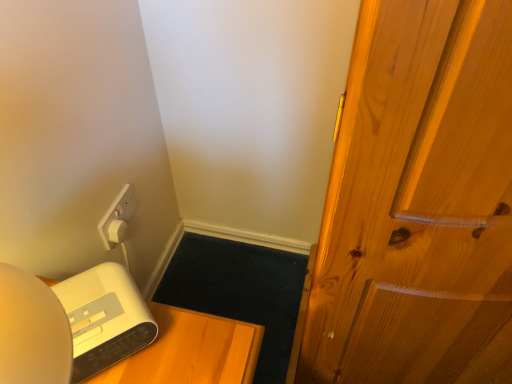
This screenshot has width=512, height=384. What do you see at coordinates (191, 351) in the screenshot?
I see `white matte speaker at lower left` at bounding box center [191, 351].

Identify the location of white matte speaker at lower left. (191, 351).

Where is `white plastic alarm clock at lower left`? The width and height of the screenshot is (512, 384). white plastic alarm clock at lower left is located at coordinates (104, 318).

What do you see at coordinates (104, 318) in the screenshot? I see `white plastic alarm clock at lower left` at bounding box center [104, 318].

Where is `white matte speaker at lower left`? This screenshot has height=384, width=512. white matte speaker at lower left is located at coordinates [191, 351].

In the image, is white matte speaker at lower left on the left side or the right side of white plastic alarm clock at lower left?

Based on their positions, white matte speaker at lower left is located to the right of white plastic alarm clock at lower left.

Is the depth of white matte speaker at lower left less than that of white plastic alarm clock at lower left?

No, the depth of white matte speaker at lower left is greater than that of white plastic alarm clock at lower left.

Is point (203, 326) behind point (105, 272)?

No, (203, 326) is in front of (105, 272).

From the image's perspective, is white matte speaker at lower left above white plastic alarm clock at lower left?

Actually, white matte speaker at lower left appears below white plastic alarm clock at lower left in the image.

From a real-world perspective, relative to white plastic alarm clock at lower left, is white matte speaker at lower left vertically above or below?

white matte speaker at lower left is situated lower than white plastic alarm clock at lower left in the real world.

Considering the sizes of objects white matte speaker at lower left and white plastic alarm clock at lower left in the image provided, who is wider, white matte speaker at lower left or white plastic alarm clock at lower left?

white matte speaker at lower left is wider.

Does white matte speaker at lower left have a lesser height compared to white plastic alarm clock at lower left?

In fact, white matte speaker at lower left may be taller than white plastic alarm clock at lower left.

From the picture: Does white matte speaker at lower left have a smaller size compared to white plastic alarm clock at lower left?

No, white matte speaker at lower left is not smaller than white plastic alarm clock at lower left.

Is white matte speaker at lower left outside of white plastic alarm clock at lower left?

Yes, white matte speaker at lower left is outside of white plastic alarm clock at lower left.

Is white matte speaker at lower left beside white plastic alarm clock at lower left?

Yes, the surface of white matte speaker at lower left is in contact with white plastic alarm clock at lower left.

Is white matte speaker at lower left facing towards white plastic alarm clock at lower left?

No, white matte speaker at lower left is not oriented towards white plastic alarm clock at lower left.

How different are the orientations of white matte speaker at lower left and white plastic alarm clock at lower left in degrees?

white matte speaker at lower left and white plastic alarm clock at lower left are facing 45.6 degrees away from each other.

I want to click on furniture below the white plastic alarm clock at lower left (from the image's perspective), so click(191, 351).

Can you confirm if white plastic alarm clock at lower left is positioned to the right of white matte speaker at lower left?

In fact, white plastic alarm clock at lower left is to the left of white matte speaker at lower left.

In the image, is white plastic alarm clock at lower left positioned in front of or behind white matte speaker at lower left?

white plastic alarm clock at lower left is positioned closer to the viewer than white matte speaker at lower left.

Is point (94, 279) more distant than point (187, 312)?

No, it is not.

From the image's perspective, is white plastic alarm clock at lower left under white matte speaker at lower left?

Actually, white plastic alarm clock at lower left appears above white matte speaker at lower left in the image.

From a real-world perspective, which is physically below, white plastic alarm clock at lower left or white matte speaker at lower left?

In real-world perspective, white matte speaker at lower left is lower.

Which object is wider, white plastic alarm clock at lower left or white matte speaker at lower left?

With larger width is white matte speaker at lower left.

Is white plastic alarm clock at lower left taller than white matte speaker at lower left?

No.

Considering the relative sizes of white plastic alarm clock at lower left and white matte speaker at lower left in the image provided, is white plastic alarm clock at lower left bigger than white matte speaker at lower left?

Actually, white plastic alarm clock at lower left might be smaller than white matte speaker at lower left.

Is white plastic alarm clock at lower left surrounding white matte speaker at lower left?

No, white matte speaker at lower left is not surrounded by white plastic alarm clock at lower left.

Are white plastic alarm clock at lower left and white matte speaker at lower left located far from each other?

No, white plastic alarm clock at lower left is in close proximity to white matte speaker at lower left.

Is white plastic alarm clock at lower left oriented towards white matte speaker at lower left?

No, white plastic alarm clock at lower left is not turned towards white matte speaker at lower left.

What's the angular difference between white plastic alarm clock at lower left and white matte speaker at lower left's facing directions?

white plastic alarm clock at lower left and white matte speaker at lower left are facing 45.6 degrees away from each other.

How distant is white plastic alarm clock at lower left from white matte speaker at lower left?

white plastic alarm clock at lower left is 2.62 inches from white matte speaker at lower left.

Locate an element on the screen. The image size is (512, 384). furniture to the right of white plastic alarm clock at lower left is located at coordinates click(x=191, y=351).

Identify the location of appliance that is in front of the white matte speaker at lower left. (104, 318).

Locate an element on the screen. This screenshot has height=384, width=512. appliance on the left of white matte speaker at lower left is located at coordinates (104, 318).